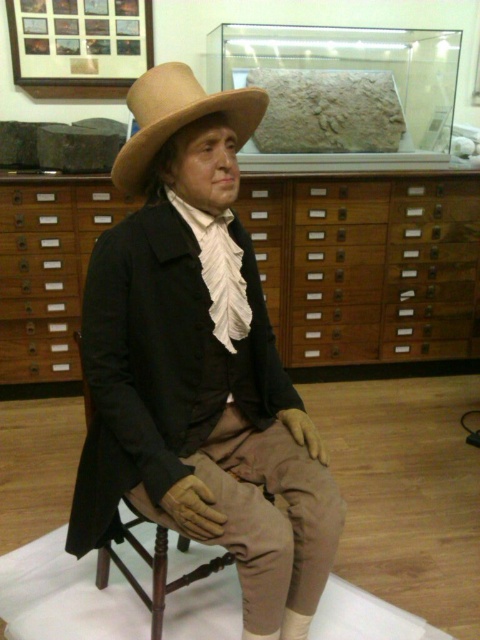
Is wooden drawers at center positioned in front of light brown felt fedora at center?

No.

Who is more distant from viewer, (86, 205) or (137, 140)?

Point (86, 205)

The image size is (480, 640). Identify the location of wooden drawers at center. (368, 266).

Between matte brown hat at center and brown wooden chair at center, which one has less height?

Standing shorter between the two is brown wooden chair at center.

Does matte brown hat at center appear on the right side of brown wooden chair at center?

Correct, you'll find matte brown hat at center to the right of brown wooden chair at center.

Who is more distant from viewer, (192, 122) or (154, 588)?

Point (154, 588)

This screenshot has width=480, height=640. Find the location of `matte brown hat at center`. matte brown hat at center is located at coordinates (197, 365).

Which is more to the right, matte brown hat at center or wooden drawers at center?

wooden drawers at center

Is matte brown hat at center below wooden drawers at center?

Indeed, matte brown hat at center is positioned under wooden drawers at center.

I want to click on matte brown hat at center, so click(x=197, y=365).

Locate an element on the screen. Image resolution: width=480 pixels, height=640 pixels. matte brown hat at center is located at coordinates (197, 365).